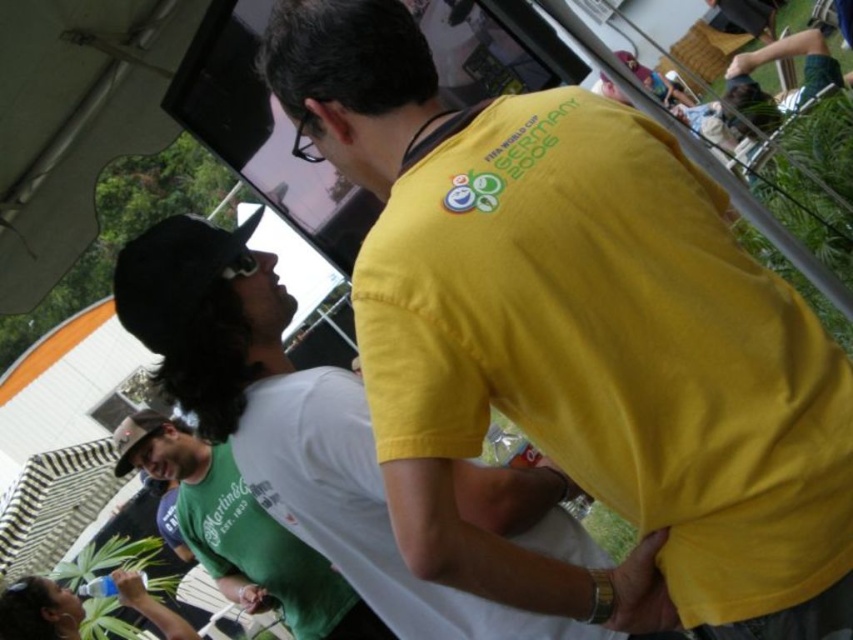
Can you confirm if yellow cotton shirt at center is positioned below green matte shirt at center?

No.

This screenshot has height=640, width=853. What do you see at coordinates (293, 422) in the screenshot? I see `yellow cotton shirt at center` at bounding box center [293, 422].

The height and width of the screenshot is (640, 853). I want to click on yellow cotton shirt at center, so click(293, 422).

Is yellow cotton shirt at upper center smaller than yellow cotton shirt at center?

Yes, yellow cotton shirt at upper center is smaller than yellow cotton shirt at center.

Can you confirm if yellow cotton shirt at upper center is positioned above yellow cotton shirt at center?

Correct, yellow cotton shirt at upper center is located above yellow cotton shirt at center.

Which is in front, point (717, 580) or point (200, 276)?

Positioned in front is point (717, 580).

Find the location of `yellow cotton shirt at upper center`. yellow cotton shirt at upper center is located at coordinates (575, 332).

Between yellow cotton shirt at upper center and green matte shirt at center, which one has more height?

Standing taller between the two is yellow cotton shirt at upper center.

Does yellow cotton shirt at upper center have a lesser width compared to green matte shirt at center?

Indeed, yellow cotton shirt at upper center has a lesser width compared to green matte shirt at center.

The height and width of the screenshot is (640, 853). Identify the location of yellow cotton shirt at upper center. (575, 332).